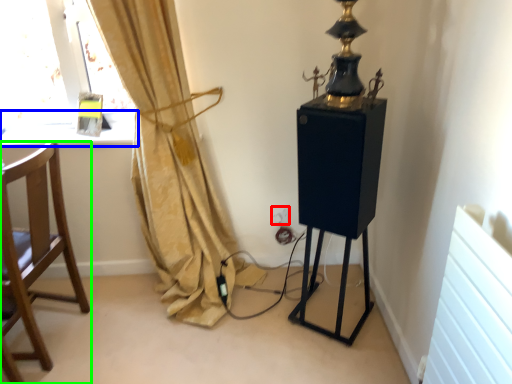
Question: Which object is the closest to the electric outlet (highlighted by a red box)? Choose among these: window sill (highlighted by a blue box) or chair (highlighted by a green box).

Choices:
 (A) window sill
 (B) chair

Answer: (A)